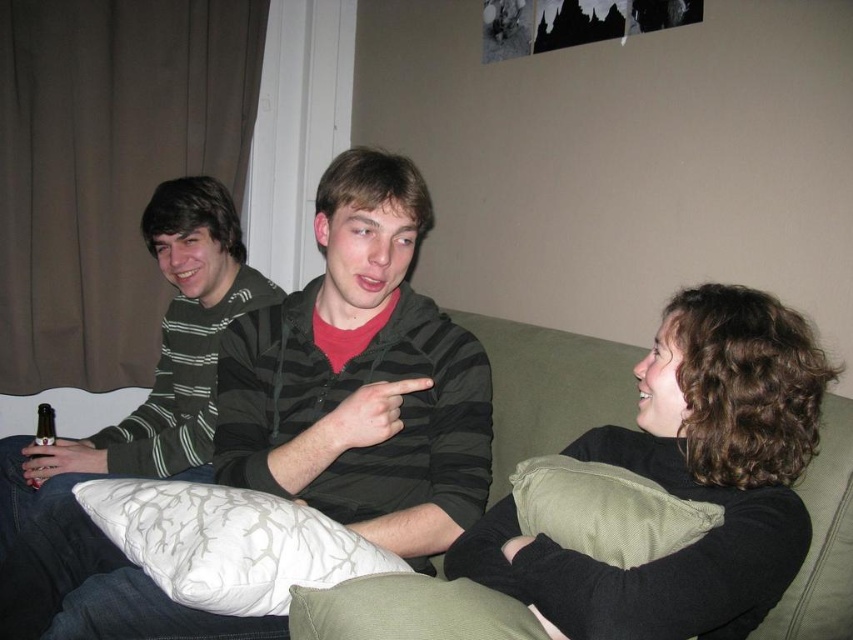
You are trying to place a striped cotton hoodie at center on a couch. There is a white textured pillow at center already occupying space. Based on the scene, where should you place the hoodie so it doesn not overlap with the pillow?

The striped cotton hoodie at center should be placed to the right side of the white textured pillow at center to avoid overlapping since the hoodie is positioned on the right side of the pillow.

In the living room scene, there is a striped cotton hoodie at center and a white textured pillow at center. Which object is wider?

The striped cotton hoodie at center is wider than the white textured pillow at center.

Where is the striped hoodie at left located in the image?

The striped hoodie at left is located at point (132,410) in the image.